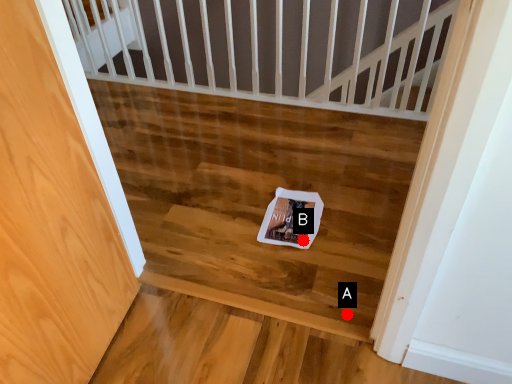
Question: Two points are circled on the image, labeled by A and B beside each circle. Which point is closer to the camera?

Choices:
 (A) A is closer
 (B) B is closer

Answer: (A)